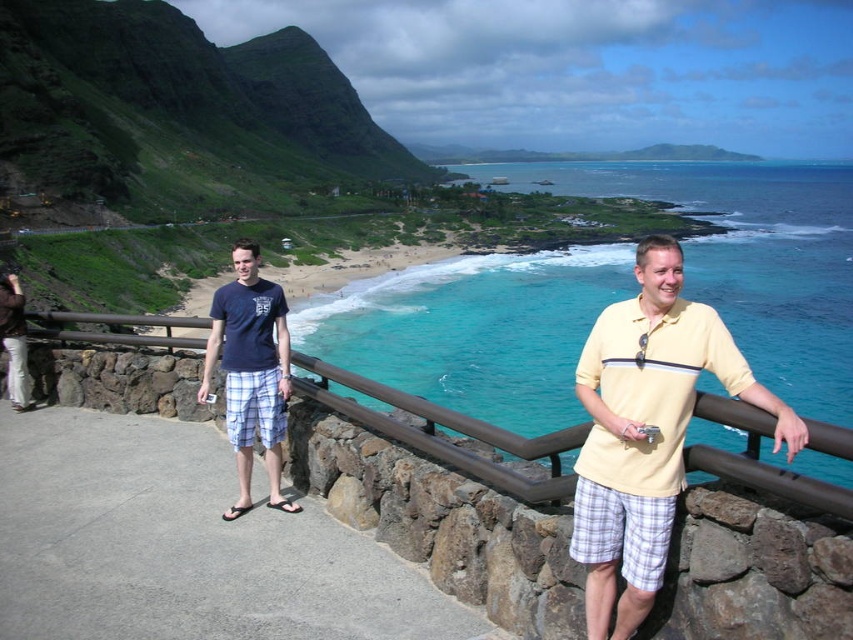
You are standing at the camera position in the coastal scene. A drone is located at point (795, 182). If you want to throw a small pebble to hit the drone, will you need to throw it more than 1500 feet?

The point (795, 182) is 1492.82 feet away from the camera. Since 1492.82 feet is less than 1500 feet, you would not need to throw the pebble more than 1500 feet to reach it.

You are a photographer trying to capture the scenic coastal view. You have a yellow cotton shirt at center and a matte black camera at lower left. Which item should you adjust to ensure the camera is visible in the frame?

Since the yellow cotton shirt at center is larger in size compared to the matte black camera at lower left, you should move the yellow cotton shirt at center further away or reduce its size to ensure the matte black camera at lower left remains visible in the frame.

In the scene shown: You are a photographer planning to take a photo of both the yellow cotton shirt at center and the matte black camera at lower left in the coastal scene. Given the distance between them, will you be able to fit both subjects into a single frame without moving your position? Please explain your reasoning.

The distance between the yellow cotton shirt at center and the matte black camera at lower left is 13.40 meters. Depending on the lens used, a wide angle lens might be necessary to capture both subjects in a single frame from your current position. However, standard lenses typically have a limited field of view, so it may not be possible without adjusting your position or using specialized equipment.